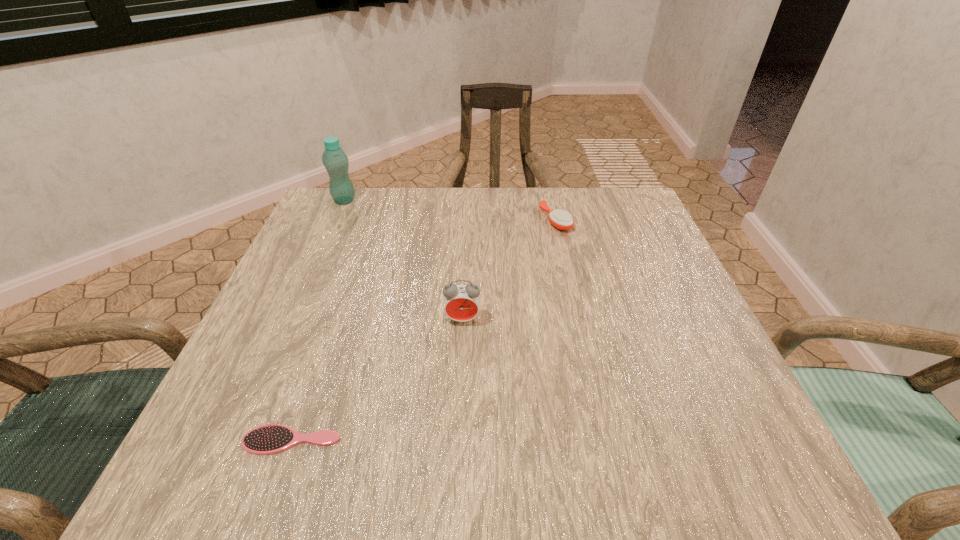
This screenshot has width=960, height=540. Find the location of `blank space at the left edge`. blank space at the left edge is located at coordinates (253, 355).

In the image, there is a desktop. Where is `vacant space at the right edge`? vacant space at the right edge is located at coordinates (652, 290).

The image size is (960, 540). Identify the location of vacant area at the far left corner of the desktop. (368, 192).

Image resolution: width=960 pixels, height=540 pixels. What are the coordinates of `vacant space at the near right corner` in the screenshot? It's located at (737, 427).

Locate an element on the screen. The height and width of the screenshot is (540, 960). vacant space that's between the tallest object and the alarm clock is located at coordinates (403, 260).

Identify the location of vacant area between the shortest object and the alarm clock. (377, 380).

The width and height of the screenshot is (960, 540). I want to click on free spot between the farthest object and the second tallest object, so click(x=403, y=260).

At what (x,y) coordinates should I click in order to perform the action: click on unoccupied area between the third shortest object and the water bottle. Please return your answer as a coordinate pair (x, y). Looking at the image, I should click on (403, 260).

Locate an element on the screen. free space between the nearest object and the farther hairbrush is located at coordinates click(423, 330).

This screenshot has width=960, height=540. I want to click on free area in between the third object from left to right and the rightmost object, so pyautogui.click(x=509, y=270).